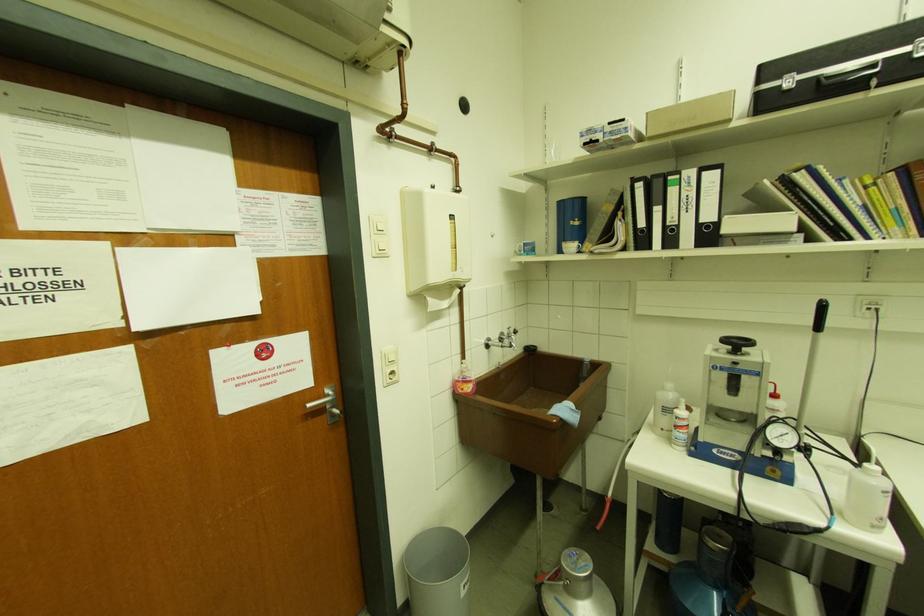
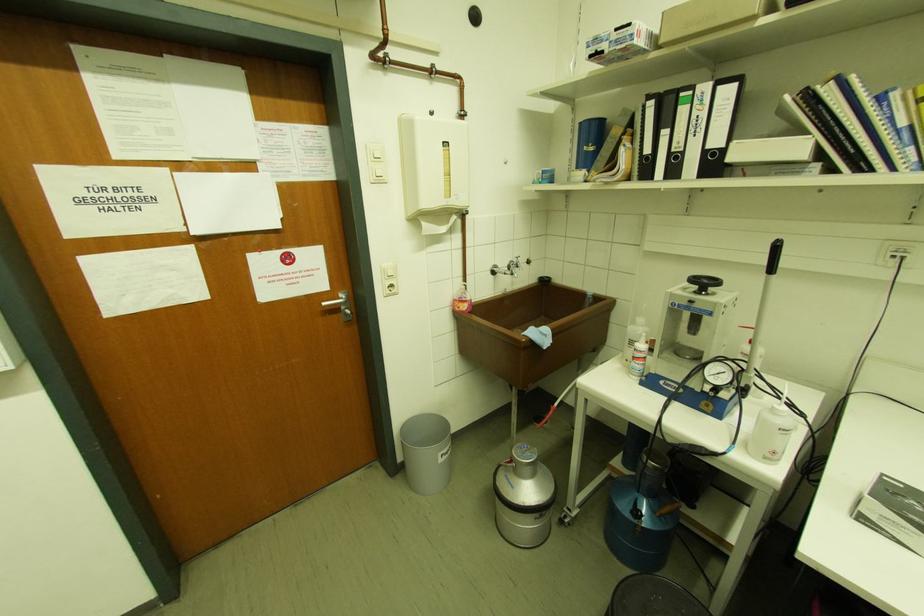
Where in the second image is the point corresponding to the point at 641,228 from the first image?

(648, 155)